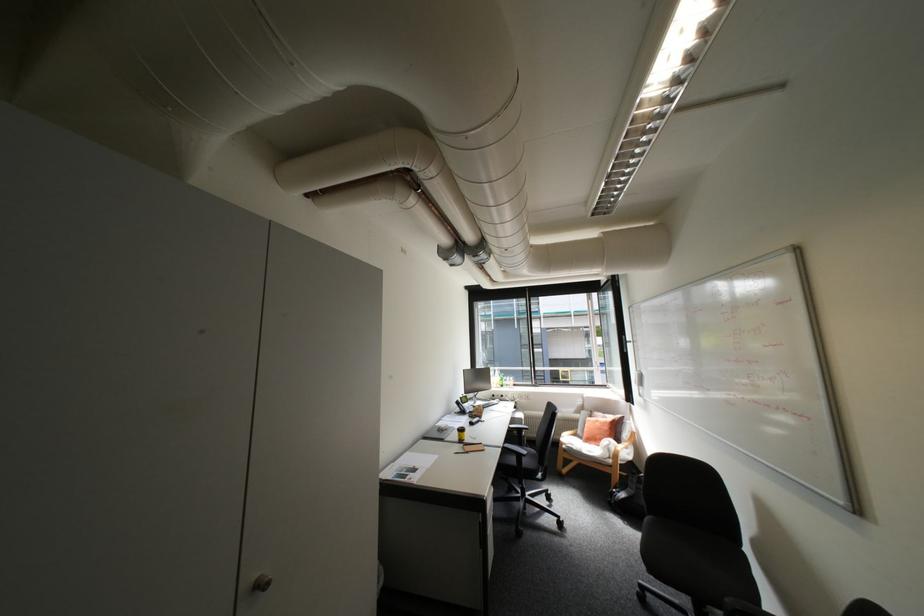
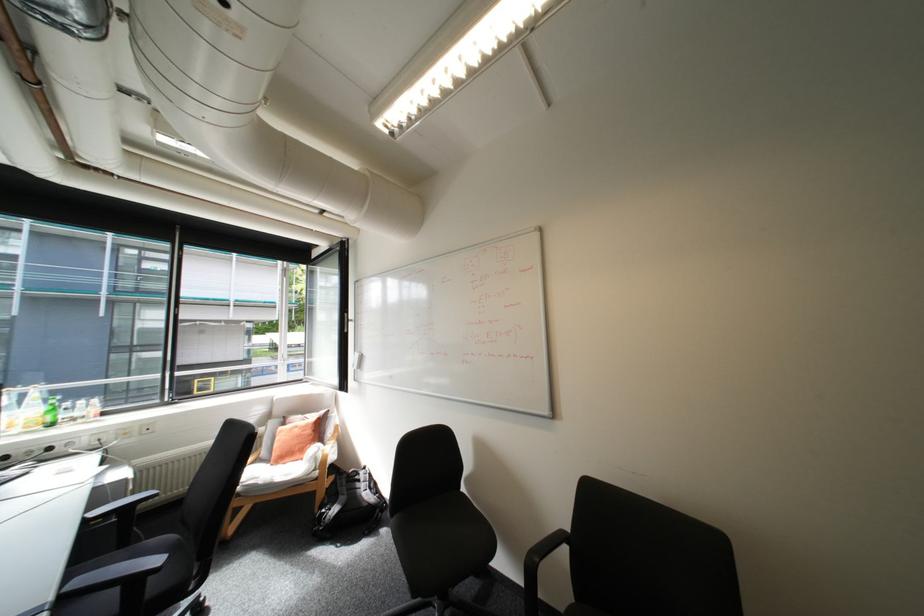
In the second image, find the point that corresponds to [512,446] in the first image.

(61, 598)